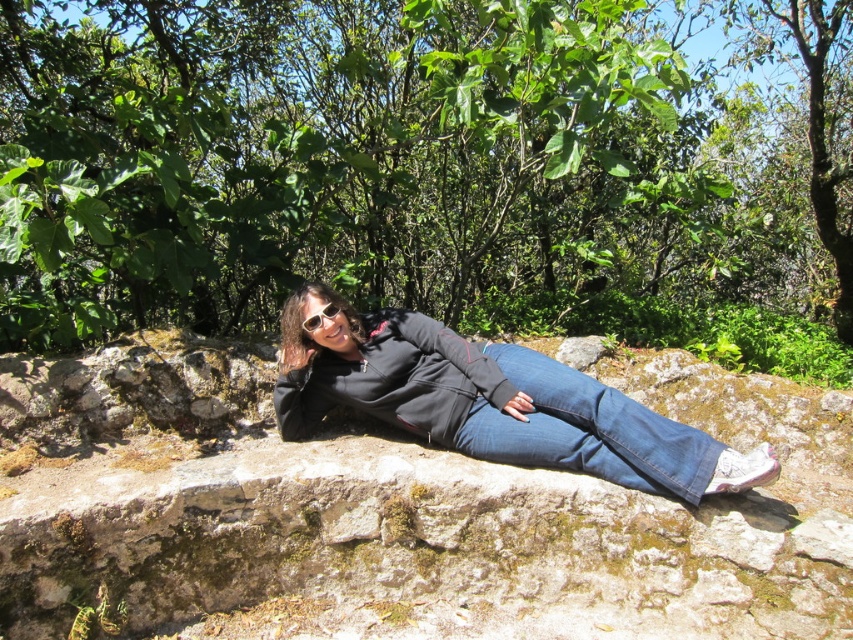
Does black matte jacket at center have a greater height compared to denim at center?

Correct, black matte jacket at center is much taller as denim at center.

Which is in front, point (612, 470) or point (698, 461)?

Point (698, 461) is more forward.

Which is in front, point (408, 355) or point (529, 349)?

Point (408, 355) is in front.

Find the location of a particular element. black matte jacket at center is located at coordinates (491, 401).

Is green leafy tree at upper center to the right of denim at center from the viewer's perspective?

Incorrect, green leafy tree at upper center is not on the right side of denim at center.

Is the position of green leafy tree at upper center less distant than that of denim at center?

No, it is not.

Does point (486, 180) come closer to viewer compared to point (653, 486)?

No.

Image resolution: width=853 pixels, height=640 pixels. Identify the location of green leafy tree at upper center. (387, 161).

Who is positioned more to the left, green leafy tree at upper center or black matte jacket at center?

green leafy tree at upper center is more to the left.

Is green leafy tree at upper center bigger than black matte jacket at center?

Incorrect, green leafy tree at upper center is not larger than black matte jacket at center.

Locate an element on the screen. This screenshot has width=853, height=640. green leafy tree at upper center is located at coordinates (387, 161).